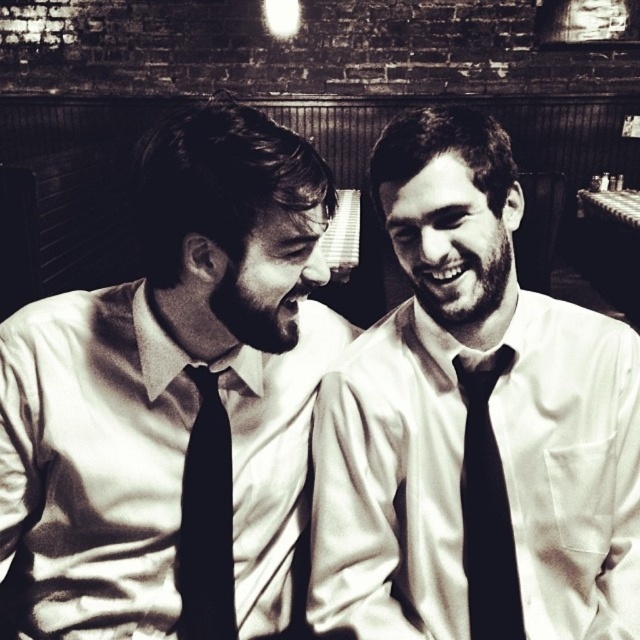
Question: Among these objects, which one is farthest from the camera?

Choices:
 (A) black silk tie at center
 (B) matte black tie at left
 (C) matte white shirt and tie at center
 (D) black silk tie at right

Answer: (D)

Question: Is matte white shirt and tie at center wider than black silk tie at center?

Choices:
 (A) yes
 (B) no

Answer: (A)

Question: Can you confirm if matte black tie at left is smaller than black silk tie at center?

Choices:
 (A) yes
 (B) no

Answer: (B)

Question: Which of these objects is positioned farthest from the matte black tie at left?

Choices:
 (A) black silk tie at center
 (B) black silk tie at right

Answer: (B)

Question: Can you confirm if matte white shirt and tie at center is wider than black silk tie at center?

Choices:
 (A) yes
 (B) no

Answer: (A)

Question: Which of the following is the closest to the observer?

Choices:
 (A) (531, 566)
 (B) (509, 612)

Answer: (B)